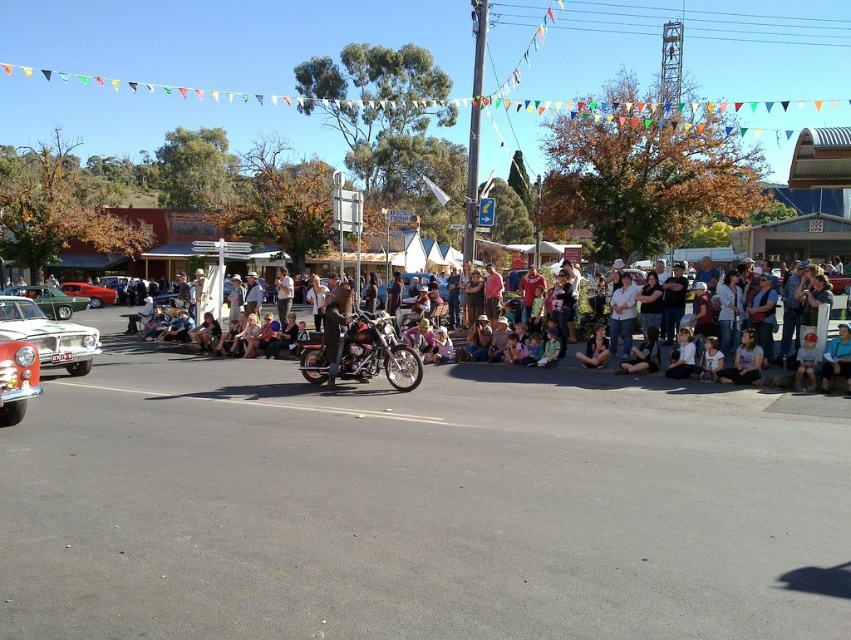
Does shiny chrome car at lower left appear under white cotton shirt at lower right?

Yes, shiny chrome car at lower left is below white cotton shirt at lower right.

Identify the location of shiny chrome car at lower left. This screenshot has height=640, width=851. (16, 378).

Who is more forward, (3, 340) or (727, 369)?

Point (3, 340) is in front.

Image resolution: width=851 pixels, height=640 pixels. I want to click on shiny chrome car at lower left, so click(x=16, y=378).

Which is above, white cotton shirt at lower right or metallic green car at left?

metallic green car at left is higher up.

Does white cotton shirt at lower right have a greater height compared to metallic green car at left?

Indeed, white cotton shirt at lower right has a greater height compared to metallic green car at left.

Does point (751, 337) lie in front of point (47, 292)?

Yes, point (751, 337) is in front of point (47, 292).

The width and height of the screenshot is (851, 640). In order to click on white cotton shirt at lower right in this screenshot , I will do `click(744, 362)`.

Is point (785, 371) closer to viewer compared to point (674, 372)?

Yes, point (785, 371) is in front of point (674, 372).

Can you confirm if matte black motorcycle at center is positioned below light blue denim jeans at lower center?

Actually, matte black motorcycle at center is above light blue denim jeans at lower center.

Where is `matte black motorcycle at center`? The image size is (851, 640). matte black motorcycle at center is located at coordinates (777, 376).

Where is `matte black motorcycle at center`? matte black motorcycle at center is located at coordinates (777, 376).